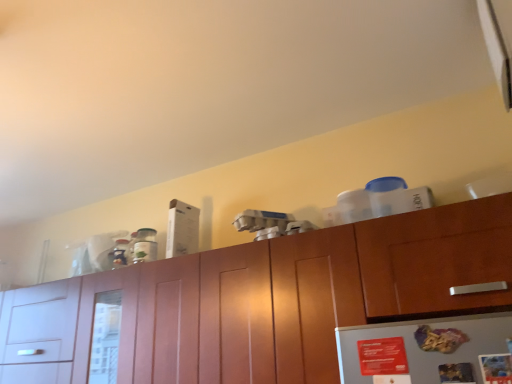
Question: Should I look upward or downward to see wooden cabinet at upper center?

Choices:
 (A) up
 (B) down

Answer: (B)